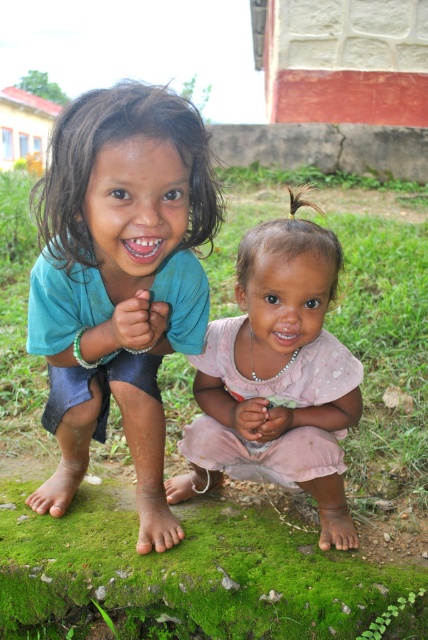
Question: Is blue fabric shirt at left in front of pink fabric dress at center?

Choices:
 (A) no
 (B) yes

Answer: (B)

Question: Can you confirm if blue fabric shirt at left is positioned to the right of pink fabric dress at center?

Choices:
 (A) no
 (B) yes

Answer: (A)

Question: Does blue fabric shirt at left have a larger size compared to pink fabric dress at center?

Choices:
 (A) yes
 (B) no

Answer: (A)

Question: Which point appears closest to the camera in this image?

Choices:
 (A) (344, 362)
 (B) (36, 509)

Answer: (A)

Question: Which point is farther to the camera?

Choices:
 (A) pink fabric dress at center
 (B) blue fabric shirt at left

Answer: (A)